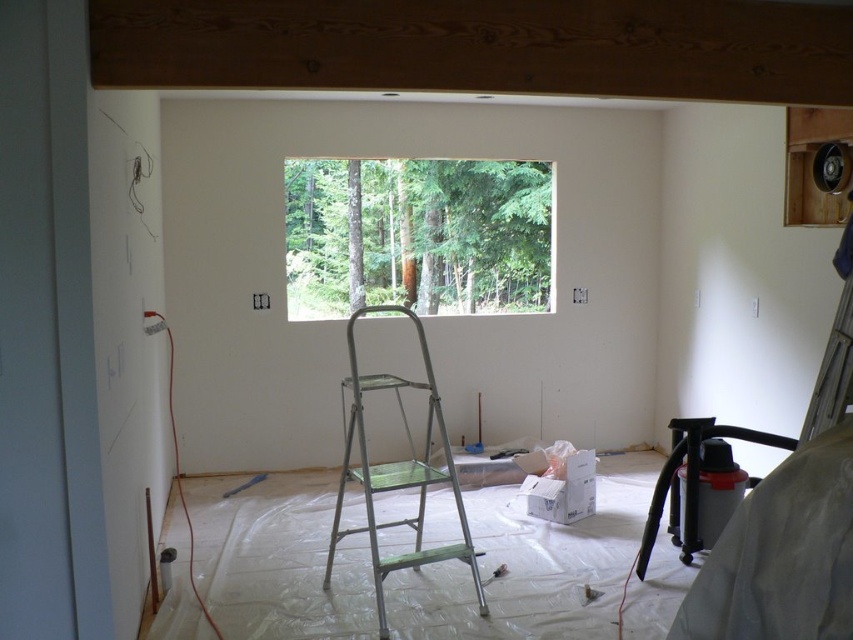
You are a painter working in this room and need to move the metallic silver step ladder at center to the left so you can access the transparent glass window at center. Is the ladder currently blocking your path to the window?

The transparent glass window at center is positioned on the right side of the metallic silver step ladder at center, meaning the ladder is blocking the path to the window. Moving the ladder to the left would clear the way for you to reach the window.

You are standing in the center of the room and want to look outside through the transparent glass window at center. In which direction should you turn your head to face the window?

The transparent glass window at center is located at point (416, 236), so you should turn your head towards the center of the room to face it.